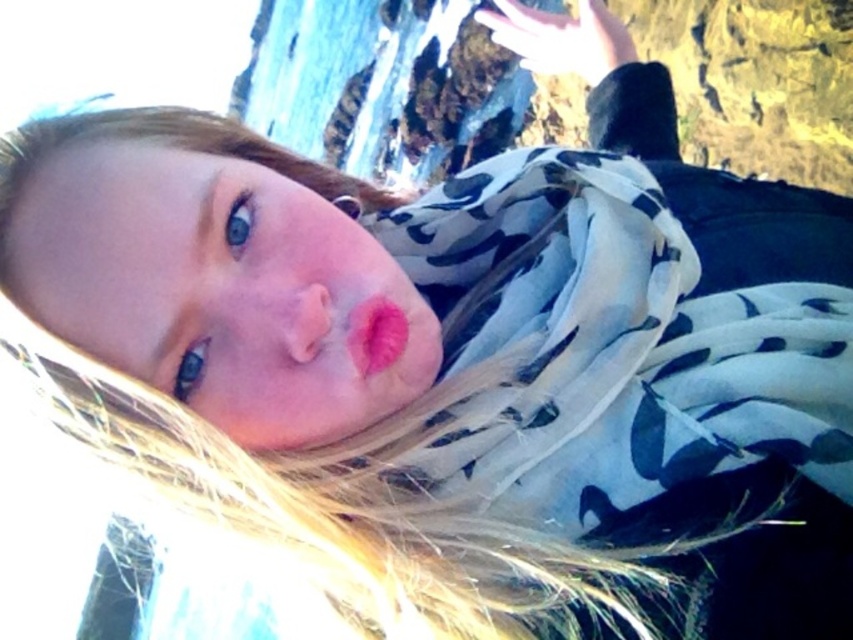
Question: Does white floral scarf at center appear on the left side of matte pink lipstick at center?

Choices:
 (A) no
 (B) yes

Answer: (A)

Question: Can you confirm if white floral scarf at center is wider than matte pink lipstick at center?

Choices:
 (A) yes
 (B) no

Answer: (A)

Question: Which object is farther from the camera taking this photo?

Choices:
 (A) matte pink lipstick at center
 (B) white floral scarf at center

Answer: (A)

Question: Which of the following is the farthest from the observer?

Choices:
 (A) (393, 337)
 (B) (606, 465)

Answer: (B)

Question: In this image, where is white floral scarf at center located relative to matte pink lipstick at center?

Choices:
 (A) below
 (B) above

Answer: (B)